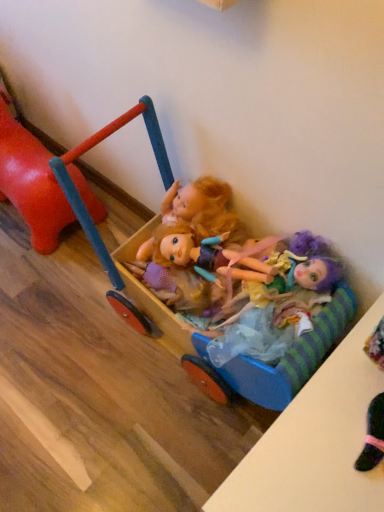
Question: Considering their positions, is rubberized red horse at left, the 2th toy when ordered from right to left, located in front of or behind multicolored fabric doll at center?

Choices:
 (A) behind
 (B) front

Answer: (A)

Question: Considering the positions of point (77, 187) and point (218, 335), is point (77, 187) closer or farther from the camera than point (218, 335)?

Choices:
 (A) farther
 (B) closer

Answer: (A)

Question: Considering the real-world distances, which object is farthest from the multicolored fabric doll at center?

Choices:
 (A) wooden cart at center, which is the first toy from right to left
 (B) rubberized red horse at left, the first toy viewed from the left

Answer: (B)

Question: Which object is the farthest from the multicolored fabric doll at center?

Choices:
 (A) wooden cart at center, which is the second toy from left to right
 (B) rubberized red horse at left, the 2th toy when ordered from right to left

Answer: (B)